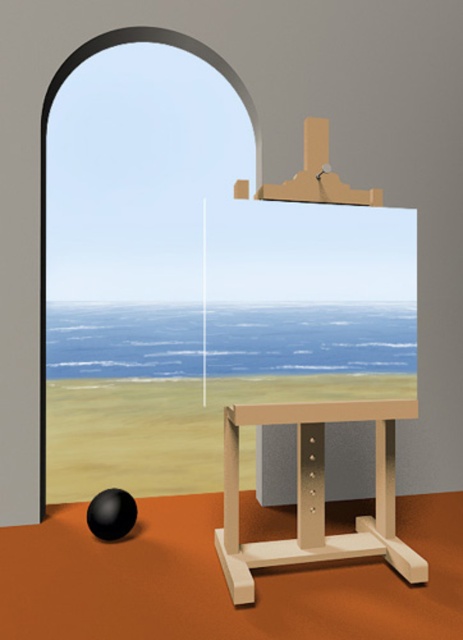
Question: Does smooth glass arch at upper left have a greater width compared to black rubber ball at lower left?

Choices:
 (A) yes
 (B) no

Answer: (A)

Question: Is smooth glass arch at upper left in front of black rubber ball at lower left?

Choices:
 (A) yes
 (B) no

Answer: (B)

Question: Which of the following is the farthest from the observer?

Choices:
 (A) smooth glass arch at upper left
 (B) black rubber ball at lower left
 (C) wooden easel at center

Answer: (A)

Question: Does wooden easel at center appear on the left side of smooth glass arch at upper left?

Choices:
 (A) no
 (B) yes

Answer: (A)

Question: Considering the real-world distances, which object is closest to the smooth glass arch at upper left?

Choices:
 (A) black rubber ball at lower left
 (B) wooden easel at center

Answer: (B)

Question: Which object is farther from the camera taking this photo?

Choices:
 (A) black rubber ball at lower left
 (B) wooden easel at center

Answer: (A)